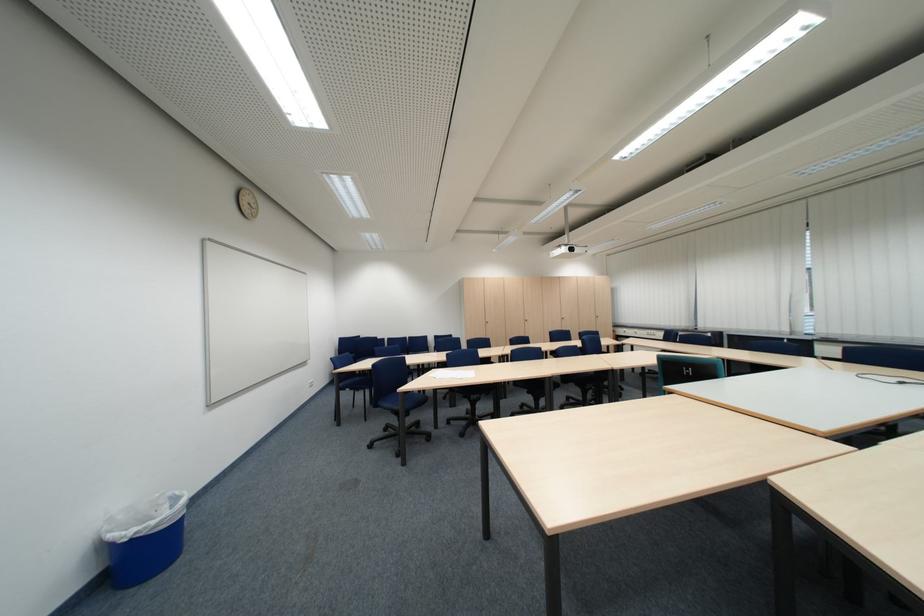
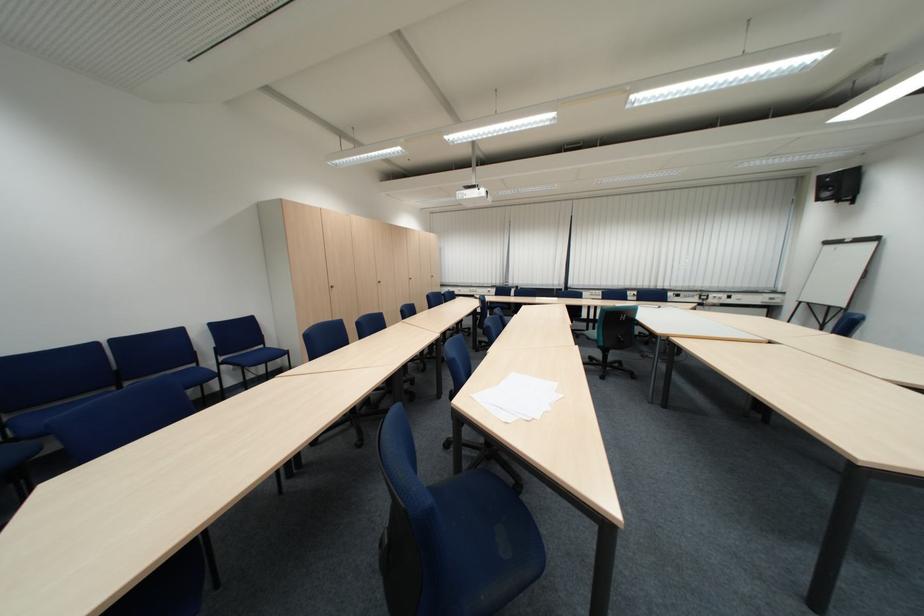
The point at (787, 330) is marked in the first image. Where is the corresponding point in the second image?

(564, 284)